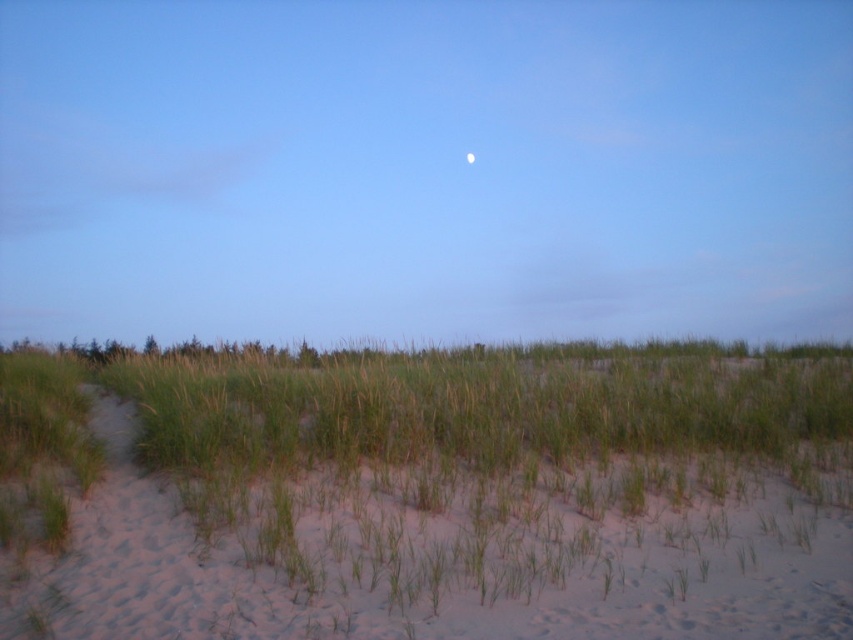
Question: Which object appears farthest from the camera in this image?

Choices:
 (A) green grass at center
 (B) white glossy moon at upper center

Answer: (B)

Question: In this image, where is green grass at center located relative to white glossy moon at upper center?

Choices:
 (A) above
 (B) below

Answer: (B)

Question: Is green grass at center closer to the viewer compared to white glossy moon at upper center?

Choices:
 (A) no
 (B) yes

Answer: (B)

Question: Is green grass at center thinner than white glossy moon at upper center?

Choices:
 (A) no
 (B) yes

Answer: (A)

Question: Which of the following is the closest to the observer?

Choices:
 (A) white glossy moon at upper center
 (B) green grass at center

Answer: (B)

Question: Which point is farther to the camera?

Choices:
 (A) green grass at center
 (B) white glossy moon at upper center

Answer: (B)